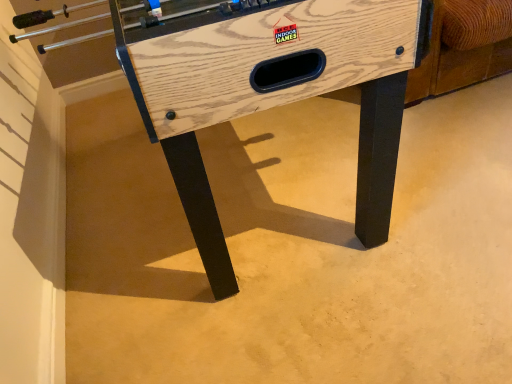
Locate an element on the screen. This screenshot has height=384, width=512. wooden foosball table at center is located at coordinates (272, 90).

Image resolution: width=512 pixels, height=384 pixels. What do you see at coordinates (272, 90) in the screenshot? I see `wooden foosball table at center` at bounding box center [272, 90].

In order to click on wooden foosball table at center in this screenshot , I will do `click(272, 90)`.